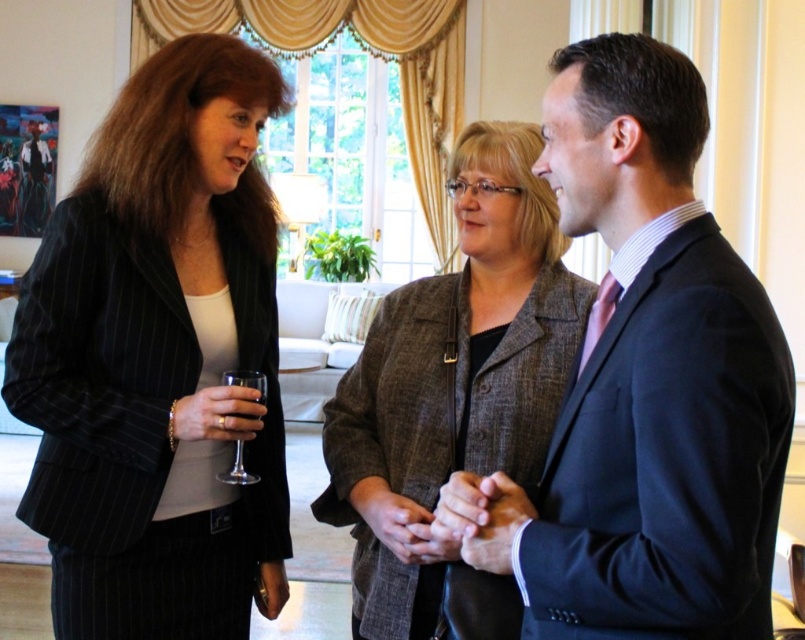
Question: Among these objects, which one is nearest to the camera?

Choices:
 (A) matte black suit at center
 (B) brown textured blazer at center

Answer: (A)

Question: Which object is positioned farthest from the brown textured blazer at center?

Choices:
 (A) matte black suit at center
 (B) clear glass wine glass at left
 (C) matte black blazer at left

Answer: (C)

Question: Can you confirm if matte black suit at center is wider than clear glass wine glass at left?

Choices:
 (A) no
 (B) yes

Answer: (B)

Question: Which point appears farthest from the camera in this image?

Choices:
 (A) (578, 180)
 (B) (428, 301)
 (C) (242, 474)
 (D) (171, 472)

Answer: (B)

Question: Does matte black blazer at left have a smaller size compared to matte black suit at center?

Choices:
 (A) yes
 (B) no

Answer: (B)

Question: Is brown textured blazer at center thinner than clear glass wine glass at left?

Choices:
 (A) no
 (B) yes

Answer: (A)